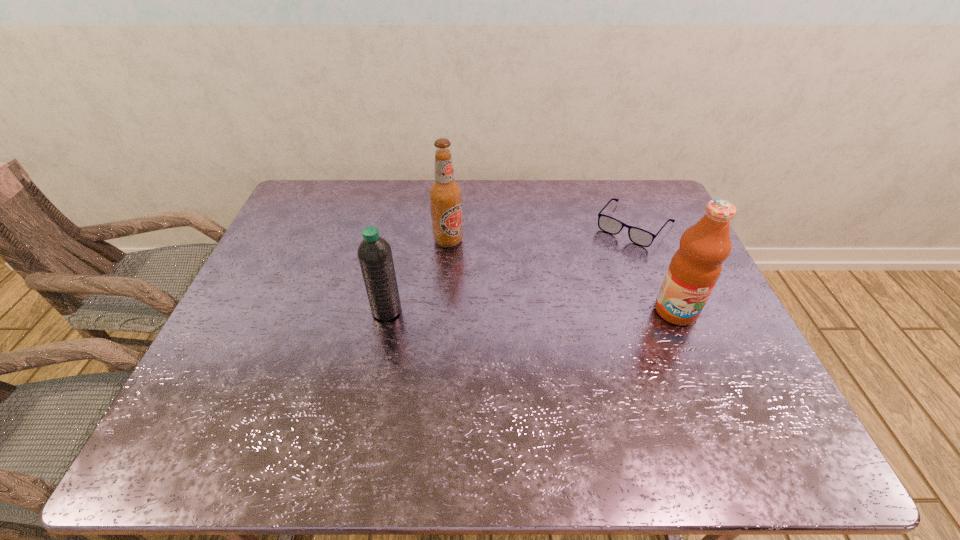
Locate an element on the screen. Image resolution: width=960 pixels, height=540 pixels. blank space at the far left corner is located at coordinates (317, 184).

The image size is (960, 540). What are the coordinates of `free region at the near left corner of the desktop` in the screenshot? It's located at (250, 389).

Locate an element on the screen. The image size is (960, 540). vacant space at the far right corner of the desktop is located at coordinates (618, 182).

I want to click on vacant space at the near right corner, so click(738, 387).

The image size is (960, 540). What are the coordinates of `free spot between the spectacles and the beer bottle` in the screenshot? It's located at (541, 233).

Locate an element on the screen. This screenshot has height=540, width=960. free space between the leftmost object and the spectacles is located at coordinates (511, 268).

At what (x,y) coordinates should I click in order to perform the action: click on free space between the shortest object and the second object from left to right. Please return your answer as a coordinate pair (x, y). The image size is (960, 540). Looking at the image, I should click on (541, 233).

The width and height of the screenshot is (960, 540). Find the location of `free space that is in between the third object from right to left and the spectacles`. free space that is in between the third object from right to left and the spectacles is located at coordinates (541, 233).

At what (x,y) coordinates should I click in order to perform the action: click on unoccupied area between the fruit juice and the water bottle. Please return your answer as a coordinate pair (x, y). This screenshot has height=540, width=960. Looking at the image, I should click on (531, 310).

Identify the location of empty space that is in between the spectacles and the water bottle. The height and width of the screenshot is (540, 960). (511, 268).